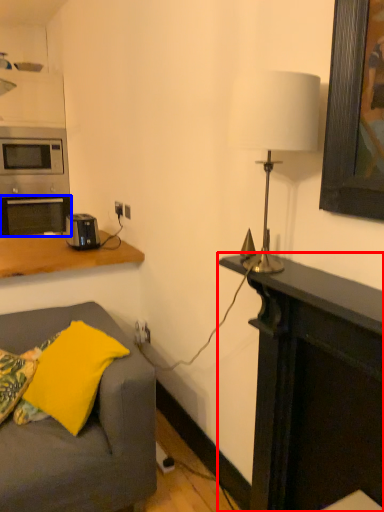
Question: Which object appears closest to the camera in this image, desk (highlighted by a red box) or oven (highlighted by a blue box)?

Choices:
 (A) desk
 (B) oven

Answer: (A)